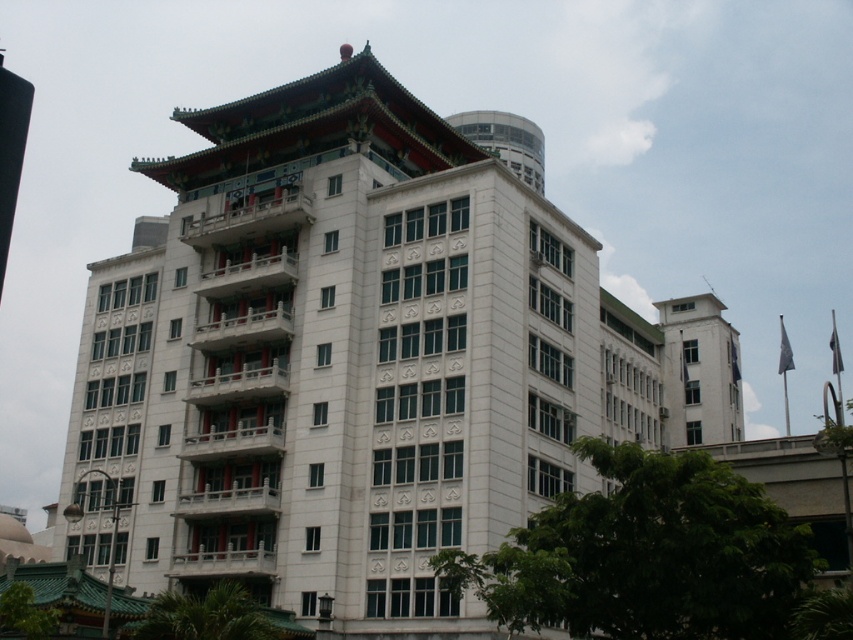
You are a photographer planning to capture the entire view of both the white stone building at center and the white smooth building at upper right in a single shot. Based on their sizes and positions, which building should you focus on first to ensure both are visible in the frame?

The white stone building at center is larger in size than the white smooth building at upper right. To ensure both are visible in the frame, focus on the white stone building at center first as it occupies more space, then adjust the camera angle to include the smaller white smooth building at upper right.

You are standing in front of the multi story building and want to take a photo of both the white stone building at center and the white smooth building at upper right. Which one will appear larger in the photo?

The white stone building at center will appear larger in the photo because it is closer to the viewer than the white smooth building at upper right.